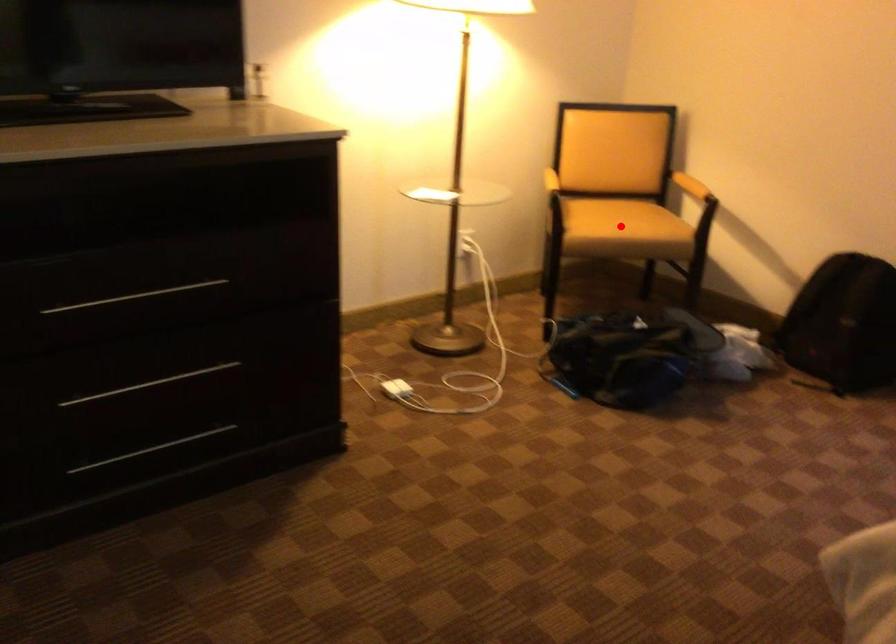
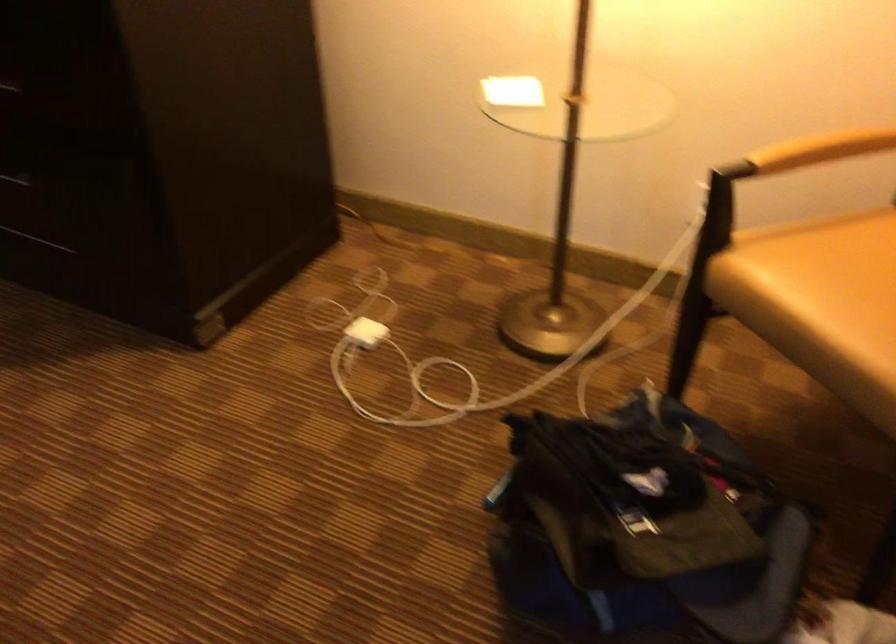
The point at the highlighted location is marked in the first image. Where is the corresponding point in the second image?

(821, 303)